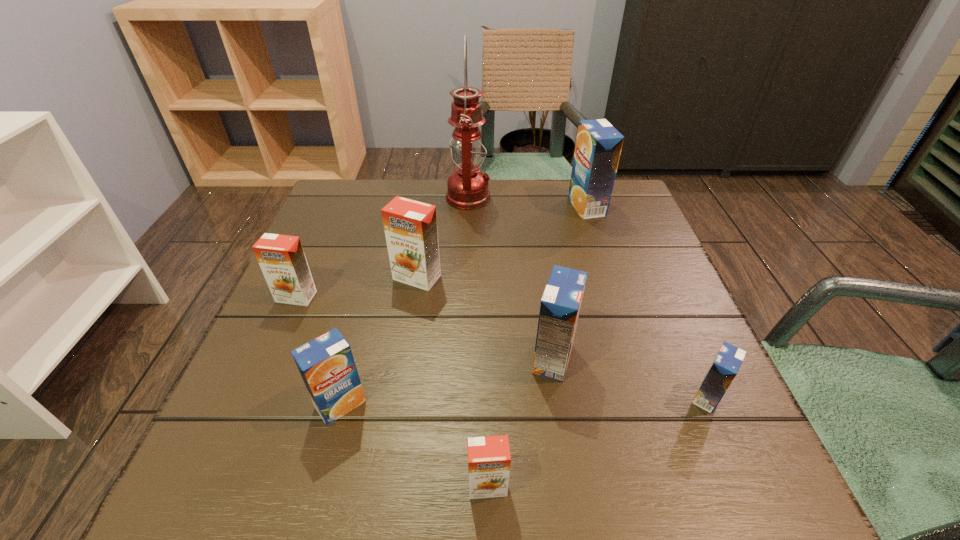
In the image, there is a desktop. Find the location of `free region at the far right corner`. free region at the far right corner is located at coordinates (582, 225).

Find the location of a particular element. The width and height of the screenshot is (960, 540). free space at the near right corner is located at coordinates (756, 496).

Locate an element on the screen. This screenshot has width=960, height=540. free space that is in between the farthest blue orange_juice and the second orange orange juice from right to left is located at coordinates (502, 242).

Where is `unoccupied area between the third biggest blue orange_juice and the oil lamp`? Image resolution: width=960 pixels, height=540 pixels. unoccupied area between the third biggest blue orange_juice and the oil lamp is located at coordinates (404, 301).

Locate an element on the screen. vacant point located between the nearest orange orange juice and the second blue orange_juice from left to right is located at coordinates (520, 422).

The width and height of the screenshot is (960, 540). In order to click on vacant area that lies between the second orange orange juice from right to left and the leftmost orange juice in this screenshot , I will do `click(357, 287)`.

Where is `vacant space that is in between the leftmost orange orange juice and the smallest orange orange juice`? The image size is (960, 540). vacant space that is in between the leftmost orange orange juice and the smallest orange orange juice is located at coordinates (392, 391).

Find the location of a particular element. This screenshot has width=960, height=540. vacant region between the second biggest orange orange juice and the tallest object is located at coordinates (382, 247).

This screenshot has width=960, height=540. What are the coordinates of `free space between the second smallest orange orange juice and the nearest orange juice` in the screenshot? It's located at (392, 391).

At what (x,y) coordinates should I click in order to perform the action: click on empty space between the rightmost orange orange juice and the leftmost orange juice. Please return your answer as a coordinate pair (x, y). The image size is (960, 540). Looking at the image, I should click on (392, 391).